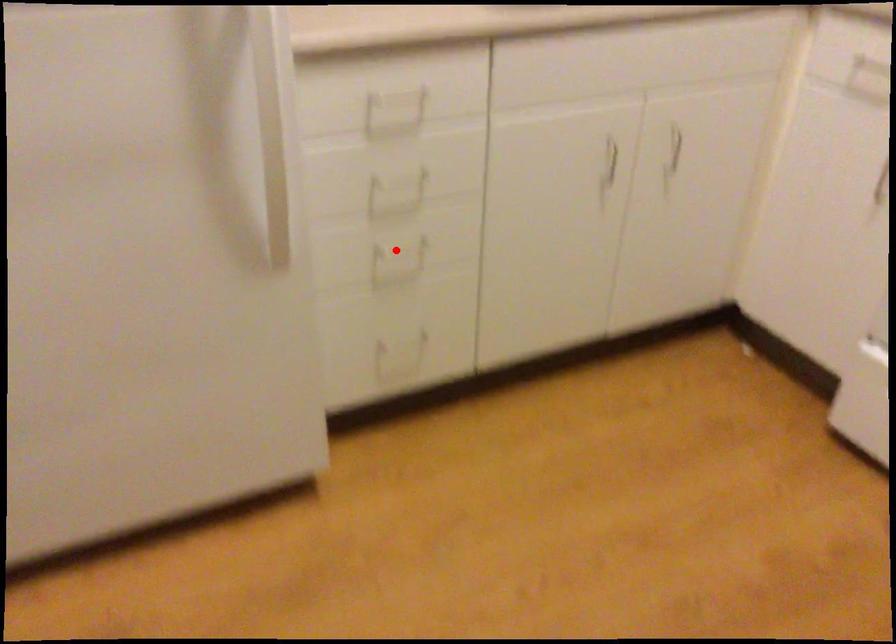
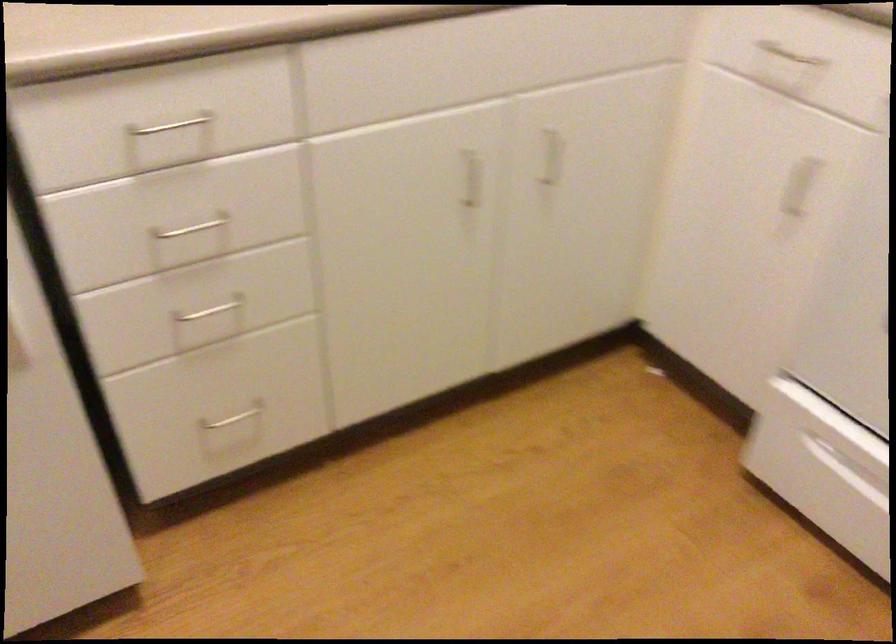
Question: I am providing you with two images of the same scene from different viewpoints. Given a red point in image1, look at the same physical point in image2. Is it:

Choices:
 (A) Closer to the viewpoint
 (B) Farther from the viewpoint

Answer: (A)